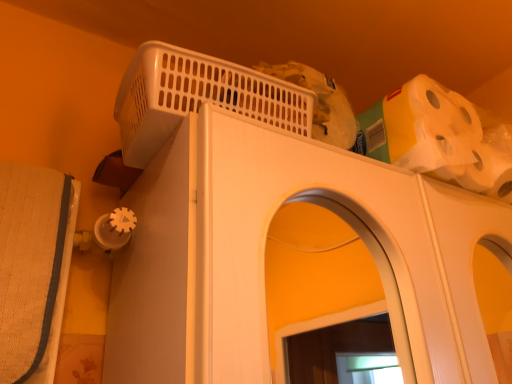
Question: Does white matte toilet paper at upper right appear on the right side of white plastic basket at upper center?

Choices:
 (A) yes
 (B) no

Answer: (A)

Question: Is white matte toilet paper at upper right with white plastic basket at upper center?

Choices:
 (A) yes
 (B) no

Answer: (B)

Question: Is white plastic basket at upper center completely or partially inside white matte toilet paper at upper right?

Choices:
 (A) yes
 (B) no

Answer: (B)

Question: From a real-world perspective, is white matte toilet paper at upper right below white plastic basket at upper center?

Choices:
 (A) yes
 (B) no

Answer: (B)

Question: Is white matte toilet paper at upper right positioned behind white plastic basket at upper center?

Choices:
 (A) no
 (B) yes

Answer: (B)

Question: Is point (175, 109) closer or farther from the camera than point (399, 157)?

Choices:
 (A) closer
 (B) farther

Answer: (A)

Question: Is white plastic basket at upper center inside the boundaries of white matte toilet paper at upper right, or outside?

Choices:
 (A) outside
 (B) inside

Answer: (A)

Question: Is white plastic basket at upper center wider or thinner than white matte toilet paper at upper right?

Choices:
 (A) wide
 (B) thin

Answer: (A)

Question: Considering the positions of white plastic basket at upper center and white matte toilet paper at upper right in the image, is white plastic basket at upper center taller or shorter than white matte toilet paper at upper right?

Choices:
 (A) tall
 (B) short

Answer: (B)

Question: Considering the positions of white plastic basket at upper center and white plastic basket at upper center in the image, is white plastic basket at upper center wider or thinner than white plastic basket at upper center?

Choices:
 (A) wide
 (B) thin

Answer: (B)

Question: From the image's perspective, is white plastic basket at upper center above or below white plastic basket at upper center?

Choices:
 (A) below
 (B) above

Answer: (B)

Question: Is white plastic basket at upper center in front of or behind white plastic basket at upper center in the image?

Choices:
 (A) front
 (B) behind

Answer: (B)

Question: Considering the positions of white plastic basket at upper center and white plastic basket at upper center in the image, is white plastic basket at upper center taller or shorter than white plastic basket at upper center?

Choices:
 (A) tall
 (B) short

Answer: (B)

Question: From the image's perspective, is white matte toilet paper at upper right positioned above or below white plastic basket at upper center?

Choices:
 (A) above
 (B) below

Answer: (B)

Question: From a real-world perspective, is white matte toilet paper at upper right above or below white plastic basket at upper center?

Choices:
 (A) below
 (B) above

Answer: (B)